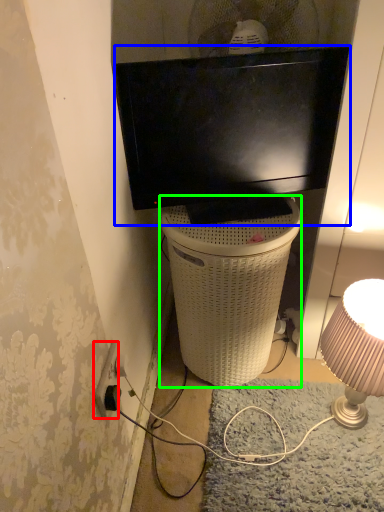
Question: Based on their relative distances, which object is nearer to power outlet (highlighted by a red box)? Choose from television (highlighted by a blue box) and trash bin/can (highlighted by a green box).

Choices:
 (A) television
 (B) trash bin/can

Answer: (B)